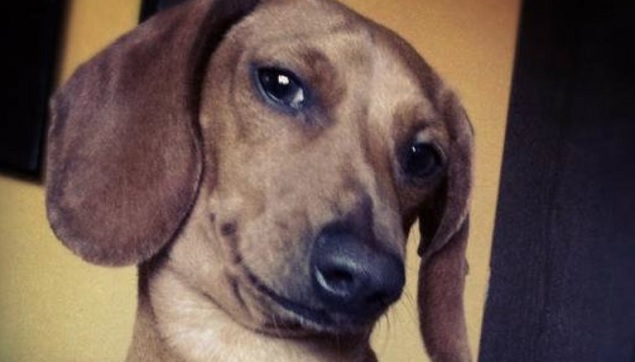
I want to click on door, so click(526, 223).